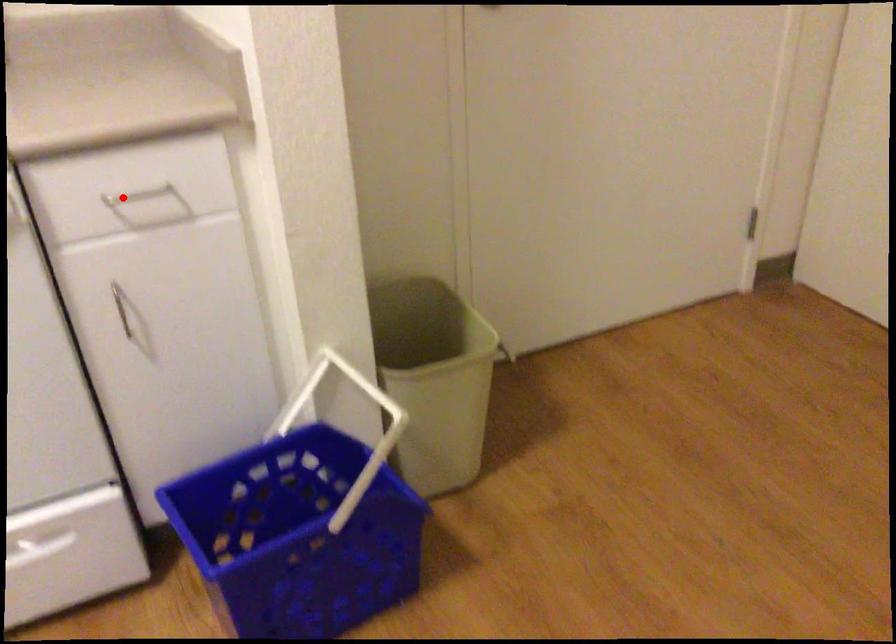
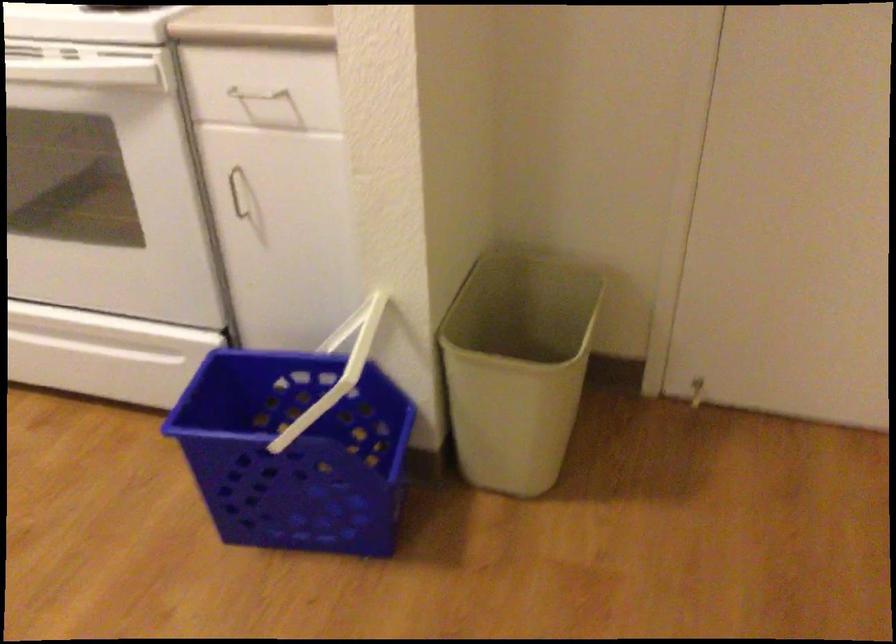
Question: I am providing you with two images of the same scene from different viewpoints. In image1, a red point is highlighted. Considering the same 3D point in image2, which of the following is correct?

Choices:
 (A) It is closer
 (B) It is farther

Answer: (B)